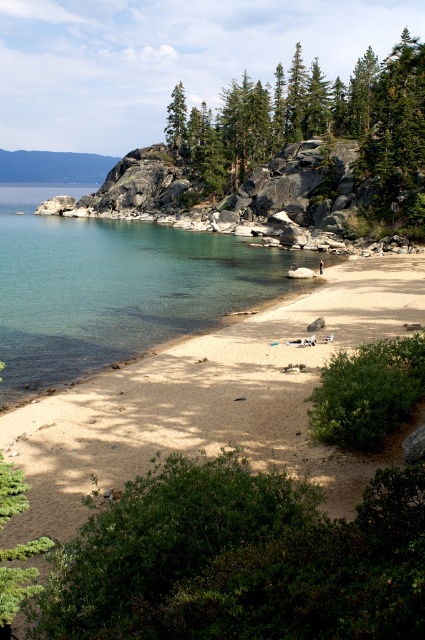
Is light brown sand at center smaller than light blue denim shorts at center?

Incorrect, light brown sand at center is not smaller in size than light blue denim shorts at center.

Between point (218, 346) and point (320, 259), which one is positioned behind?

The point (320, 259) is behind.

At what (x,y) coordinates should I click in order to perform the action: click on light brown sand at center. Please return your answer as a coordinate pair (x, y). This screenshot has height=640, width=425. Looking at the image, I should click on [207, 397].

Is clear glass water at center shorter than green textured pine trees at upper center?

In fact, clear glass water at center may be taller than green textured pine trees at upper center.

Between clear glass water at center and green textured pine trees at upper center, which one is positioned lower?

Positioned lower is clear glass water at center.

Is point (14, 358) in front of point (311, 86)?

Yes, point (14, 358) is closer to viewer.

Find the location of a particular element. This screenshot has width=425, height=640. clear glass water at center is located at coordinates (113, 288).

Is point (28, 426) positioned after point (346, 134)?

No, it is not.

Does point (121, 422) come in front of point (360, 124)?

Yes, point (121, 422) is in front of point (360, 124).

Identify the location of light brown sand at center. Image resolution: width=425 pixels, height=640 pixels. (207, 397).